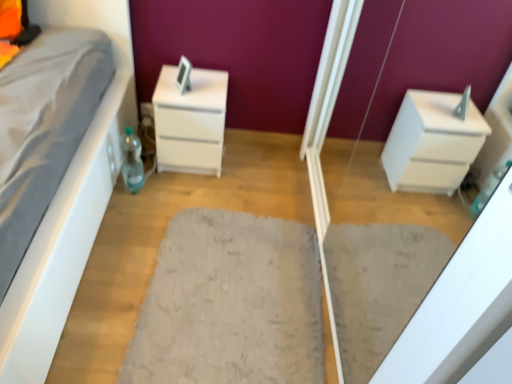
Question: Considering their positions, is translucent plastic bottle at lower left located in front of or behind white glossy chest of drawers at center?

Choices:
 (A) behind
 (B) front

Answer: (B)

Question: In the image, is translucent plastic bottle at lower left on the left side or the right side of white glossy chest of drawers at center?

Choices:
 (A) left
 (B) right

Answer: (A)

Question: Which of these objects is positioned closest to the white glossy drawer at right?

Choices:
 (A) gray fluffy rug at center
 (B) translucent plastic bottle at lower left
 (C) white glossy chest of drawers at center

Answer: (A)

Question: Which object is positioned farthest from the white glossy drawer at right?

Choices:
 (A) gray fluffy rug at center
 (B) translucent plastic bottle at lower left
 (C) white glossy chest of drawers at center

Answer: (B)